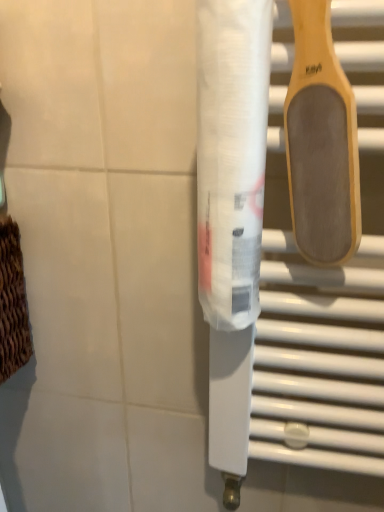
The image size is (384, 512). Describe the element at coordinates (231, 156) in the screenshot. I see `transparent plastic toilet paper at center` at that location.

Locate an element on the screen. transparent plastic toilet paper at center is located at coordinates pos(231,156).

What do you see at coordinates (321, 142) in the screenshot?
I see `wooden/textured spatula at upper right` at bounding box center [321, 142].

At what (x,y) coordinates should I click in order to perform the action: click on wooden/textured spatula at upper right. Please return your answer as a coordinate pair (x, y). The image size is (384, 512). Looking at the image, I should click on coord(321,142).

At what (x,y) coordinates should I click in order to perform the action: click on transparent plastic toilet paper at center. Please return your answer as a coordinate pair (x, y). This screenshot has height=512, width=384. Looking at the image, I should click on (231, 156).

Considering the relative positions of transparent plastic toilet paper at center and wooden/textured spatula at upper right in the image provided, is transparent plastic toilet paper at center to the left or to the right of wooden/textured spatula at upper right?

Clearly, transparent plastic toilet paper at center is on the left of wooden/textured spatula at upper right in the image.

Which is behind, transparent plastic toilet paper at center or wooden/textured spatula at upper right?

Positioned behind is transparent plastic toilet paper at center.

Is point (228, 159) closer or farther from the camera than point (310, 19)?

Point (228, 159).

From the image's perspective, between transparent plastic toilet paper at center and wooden/textured spatula at upper right, which one is located above?

From the image's view, wooden/textured spatula at upper right is above.

From a real-world perspective, is transparent plastic toilet paper at center physically located above or below wooden/textured spatula at upper right?

transparent plastic toilet paper at center is below wooden/textured spatula at upper right.

Looking at their sizes, would you say transparent plastic toilet paper at center is wider or thinner than wooden/textured spatula at upper right?

Considering their sizes, transparent plastic toilet paper at center looks broader than wooden/textured spatula at upper right.

Does transparent plastic toilet paper at center have a greater height compared to wooden/textured spatula at upper right?

Yes.

Who is smaller, transparent plastic toilet paper at center or wooden/textured spatula at upper right?

wooden/textured spatula at upper right is smaller.

Is transparent plastic toilet paper at center located outside wooden/textured spatula at upper right?

Yes.

Can you see transparent plastic toilet paper at center touching wooden/textured spatula at upper right?

Yes, transparent plastic toilet paper at center is in contact with wooden/textured spatula at upper right.

Could you tell me if transparent plastic toilet paper at center is turned towards wooden/textured spatula at upper right?

No, transparent plastic toilet paper at center is not facing towards wooden/textured spatula at upper right.

What's the angular difference between transparent plastic toilet paper at center and wooden/textured spatula at upper right's facing directions?

The facing directions of transparent plastic toilet paper at center and wooden/textured spatula at upper right are 0.0064 degrees apart.

Locate an element on the screen. spatula located in front of the transparent plastic toilet paper at center is located at coordinates (321, 142).

Considering the relative positions of wooden/textured spatula at upper right and transparent plastic toilet paper at center in the image provided, is wooden/textured spatula at upper right to the left of transparent plastic toilet paper at center from the viewer's perspective?

Incorrect, wooden/textured spatula at upper right is not on the left side of transparent plastic toilet paper at center.

Relative to transparent plastic toilet paper at center, is wooden/textured spatula at upper right in front or behind?

In the image, wooden/textured spatula at upper right appears in front of transparent plastic toilet paper at center.

Which is closer to the camera, (359, 202) or (244, 182)?

Clearly, point (359, 202) is more distant from the camera than point (244, 182).

From the image's perspective, which is below, wooden/textured spatula at upper right or transparent plastic toilet paper at center?

From the image's view, transparent plastic toilet paper at center is below.

From a real-world perspective, which object rests below the other?

From a 3D spatial view, transparent plastic toilet paper at center is below.

Considering the relative sizes of wooden/textured spatula at upper right and transparent plastic toilet paper at center in the image provided, is wooden/textured spatula at upper right thinner than transparent plastic toilet paper at center?

Yes.

Considering the relative sizes of wooden/textured spatula at upper right and transparent plastic toilet paper at center in the image provided, is wooden/textured spatula at upper right shorter than transparent plastic toilet paper at center?

Yes, wooden/textured spatula at upper right is shorter than transparent plastic toilet paper at center.

Can you confirm if wooden/textured spatula at upper right is smaller than transparent plastic toilet paper at center?

Yes, wooden/textured spatula at upper right is smaller than transparent plastic toilet paper at center.

Is wooden/textured spatula at upper right inside the boundaries of transparent plastic toilet paper at center, or outside?

The correct answer is: outside.

Does wooden/textured spatula at upper right touch transparent plastic toilet paper at center?

Yes, wooden/textured spatula at upper right is with transparent plastic toilet paper at center.

Could you tell me if wooden/textured spatula at upper right is turned towards transparent plastic toilet paper at center?

No, wooden/textured spatula at upper right is not oriented towards transparent plastic toilet paper at center.

How different are the orientations of wooden/textured spatula at upper right and transparent plastic toilet paper at center in degrees?

0.0064 degrees separate the facing orientations of wooden/textured spatula at upper right and transparent plastic toilet paper at center.

This screenshot has height=512, width=384. Identify the location of spatula above the transparent plastic toilet paper at center (from a real-world perspective). (321, 142).

The width and height of the screenshot is (384, 512). In order to click on toilet paper below the wooden/textured spatula at upper right (from a real-world perspective) in this screenshot , I will do `click(231, 156)`.

Image resolution: width=384 pixels, height=512 pixels. I want to click on toilet paper that appears below the wooden/textured spatula at upper right (from the image's perspective), so click(x=231, y=156).